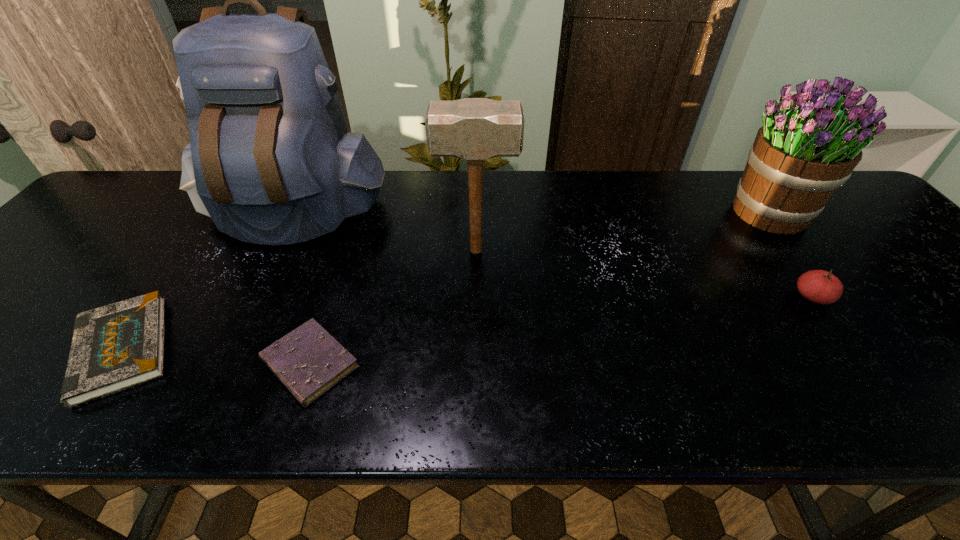
This screenshot has width=960, height=540. Find the location of `free point located on the right of the fifth tallest object`. free point located on the right of the fifth tallest object is located at coordinates (240, 349).

Identify the location of blank space located on the right of the shortest object. (558, 363).

Locate an element on the screen. The image size is (960, 540). backpack at the far edge is located at coordinates (270, 160).

Where is `bouquet at the far edge`? The image size is (960, 540). bouquet at the far edge is located at coordinates (810, 142).

You are a GUI agent. You are given a task and a screenshot of the screen. Output one action in this format:
    pyautogui.click(x=<x>, y=<y>)
    Task: Click on the notebook at the near edge
    This screenshot has height=540, width=960.
    Given the screenshot: What is the action you would take?
    pyautogui.click(x=115, y=347)

Where is `diary that is at the near edge`? diary that is at the near edge is located at coordinates (308, 361).

Locate an element on the screen. object at the right edge is located at coordinates (810, 142).

Where is `object that is at the far right corner`? object that is at the far right corner is located at coordinates (810, 142).

The image size is (960, 540). What are the coordinates of `vacant area at the far edge of the desktop` in the screenshot? It's located at (622, 181).

Find the location of `blank space at the left edge`. blank space at the left edge is located at coordinates (55, 261).